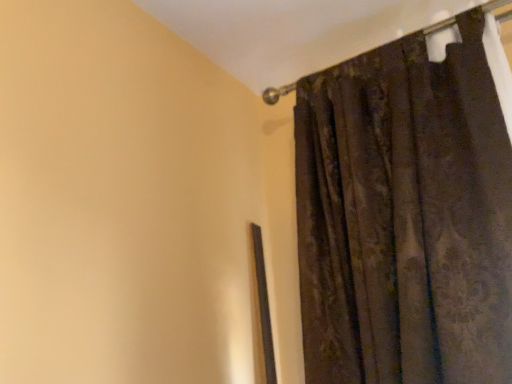
What do you see at coordinates (405, 217) in the screenshot? I see `velvet brown curtain at upper right` at bounding box center [405, 217].

Find the location of a particular element. The height and width of the screenshot is (384, 512). velvet brown curtain at upper right is located at coordinates (405, 217).

You are a GUI agent. You are given a task and a screenshot of the screen. Output one action in this format:
    pyautogui.click(x=<x>, y=<y>)
    Task: Click on the velvet brown curtain at upper right
    This screenshot has height=384, width=512.
    Given the screenshot: What is the action you would take?
    pyautogui.click(x=405, y=217)